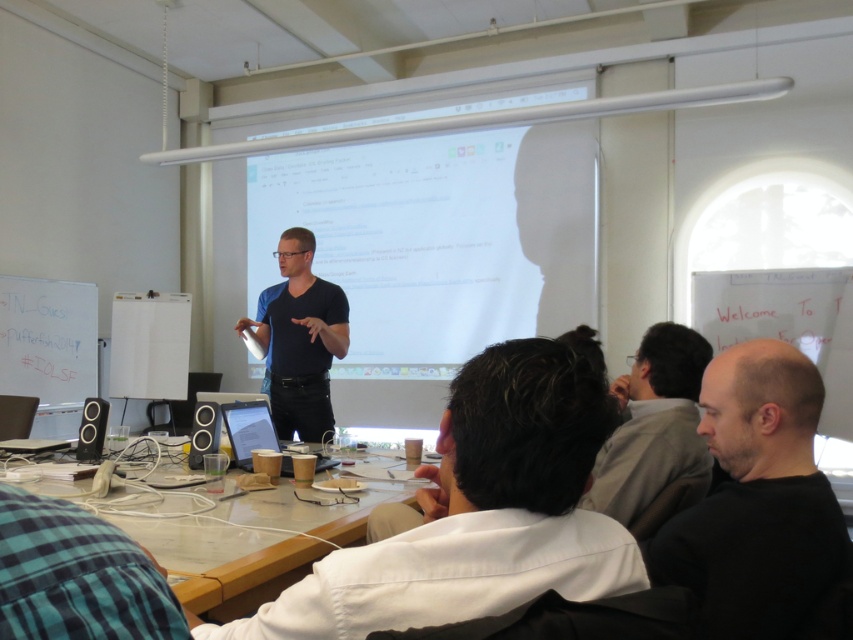
Which is behind, point (654, 467) or point (341, 349)?

Point (341, 349)

Between gray fabric shirt at center and black matte shirt at center, which one has less height?

With less height is gray fabric shirt at center.

The height and width of the screenshot is (640, 853). Describe the element at coordinates (654, 432) in the screenshot. I see `gray fabric shirt at center` at that location.

Locate an element on the screen. The image size is (853, 640). gray fabric shirt at center is located at coordinates (654, 432).

Who is taller, wooden table at lower center or gray fabric shirt at center?

gray fabric shirt at center

Who is positioned more to the left, wooden table at lower center or gray fabric shirt at center?

wooden table at lower center

What do you see at coordinates (247, 544) in the screenshot?
I see `wooden table at lower center` at bounding box center [247, 544].

Locate an element on the screen. This screenshot has height=640, width=853. wooden table at lower center is located at coordinates (247, 544).

Consider the image. Can you confirm if white cotton shirt at center is taller than wooden table at lower center?

Indeed, white cotton shirt at center has a greater height compared to wooden table at lower center.

Is white cotton shirt at center above wooden table at lower center?

Yes.

Who is more forward, (294, 588) or (206, 604)?

Point (294, 588) is in front.

Identify the location of white cotton shirt at center. The image size is (853, 640). (479, 513).